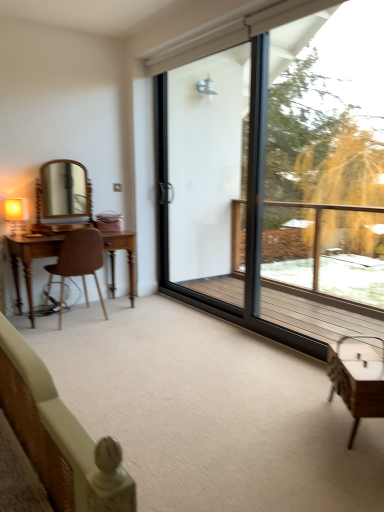
Find the location of a particular element. The image size is (384, 512). vacant space in front of brown leather chair at left is located at coordinates (80, 334).